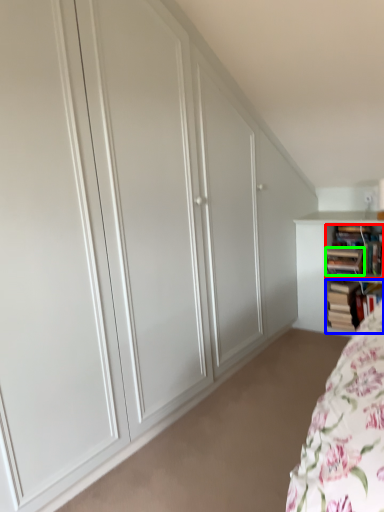
Question: Considering the real-world distances, which object is farthest from book (highlighted by a red box)? book (highlighted by a blue box) or book (highlighted by a green box)?

Choices:
 (A) book
 (B) book

Answer: (A)